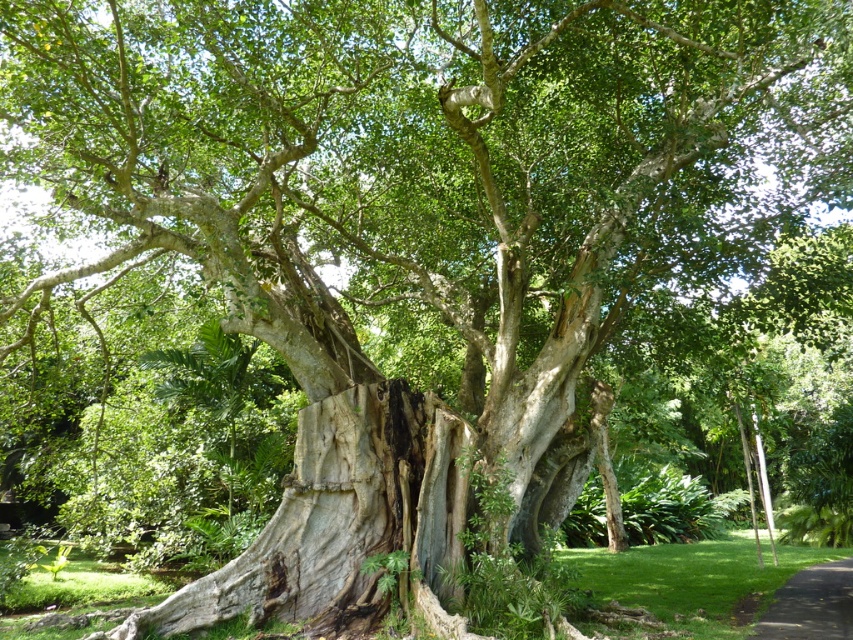
Which is more to the left, gray rough bark tree trunk at center or black asphalt path at lower right?

gray rough bark tree trunk at center

Does point (397, 486) come behind point (833, 624)?

No.

Is point (444, 513) positioned behind point (808, 573)?

No, (444, 513) is closer to viewer.

Image resolution: width=853 pixels, height=640 pixels. In order to click on gray rough bark tree trunk at center in this screenshot , I will do `click(338, 515)`.